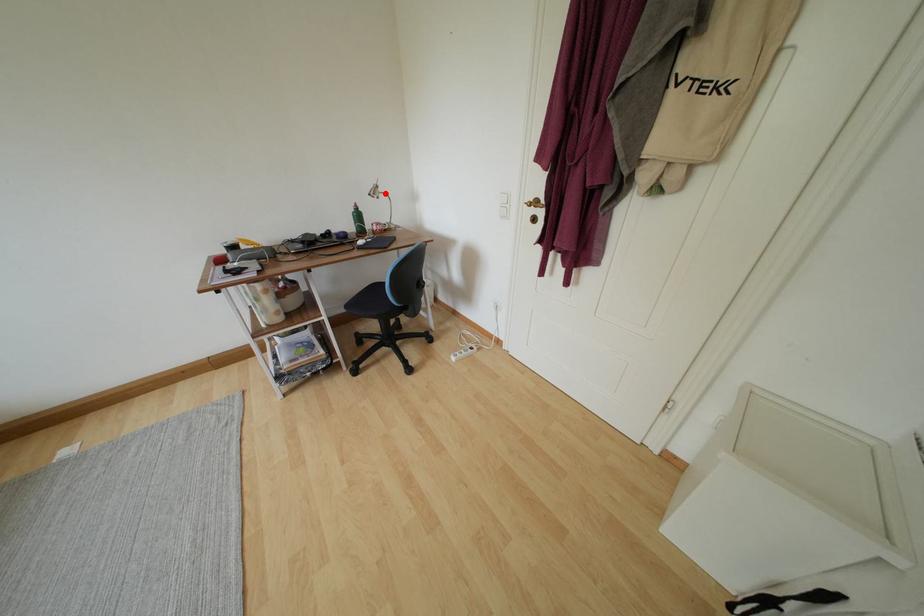
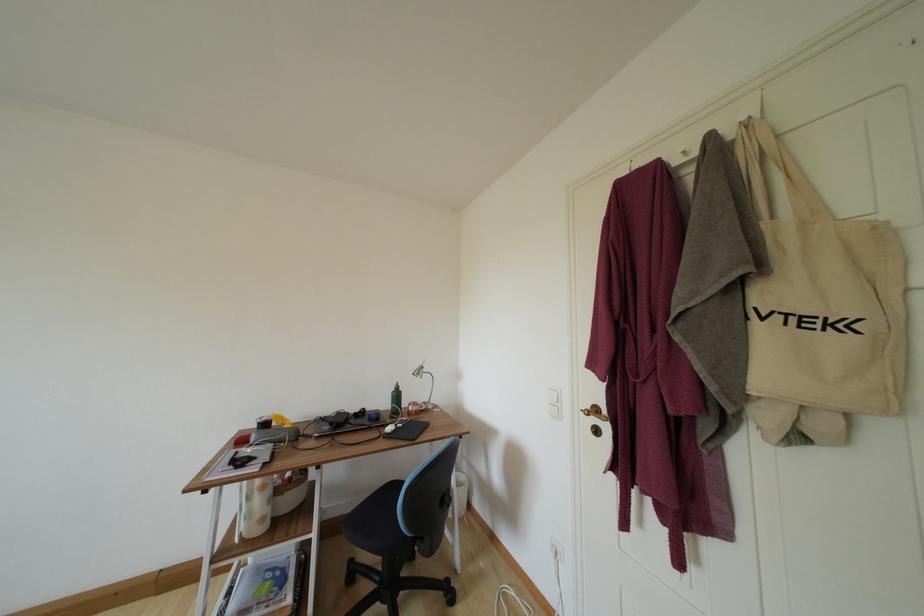
In the second image, find the point that corresponds to the highlighted location in the first image.

(430, 374)